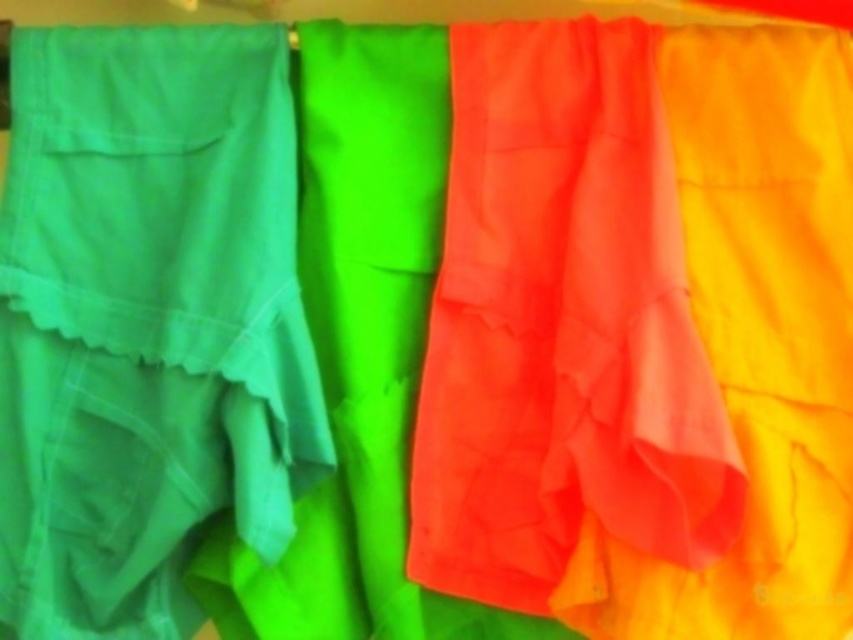
Question: In this image, where is matte green skirt at left located relative to matte orange fabric at center?

Choices:
 (A) below
 (B) above

Answer: (A)

Question: Does matte green skirt at left appear over matte orange fabric at center?

Choices:
 (A) yes
 (B) no

Answer: (B)

Question: Can you confirm if matte green skirt at left is positioned to the left of matte orange fabric at center?

Choices:
 (A) yes
 (B) no

Answer: (A)

Question: Which point is farther from the camera taking this photo?

Choices:
 (A) (202, 65)
 (B) (514, 429)

Answer: (A)